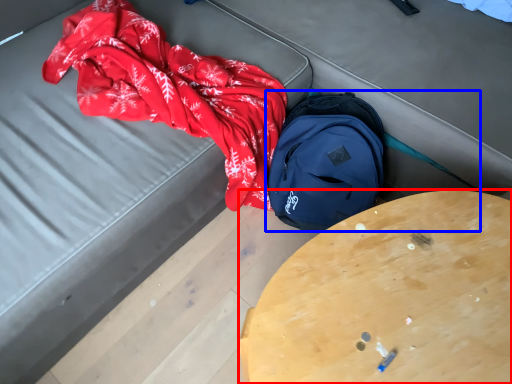
Question: Which object appears farthest to the camera in this image, table (highlighted by a red box) or backpack (highlighted by a blue box)?

Choices:
 (A) table
 (B) backpack

Answer: (B)